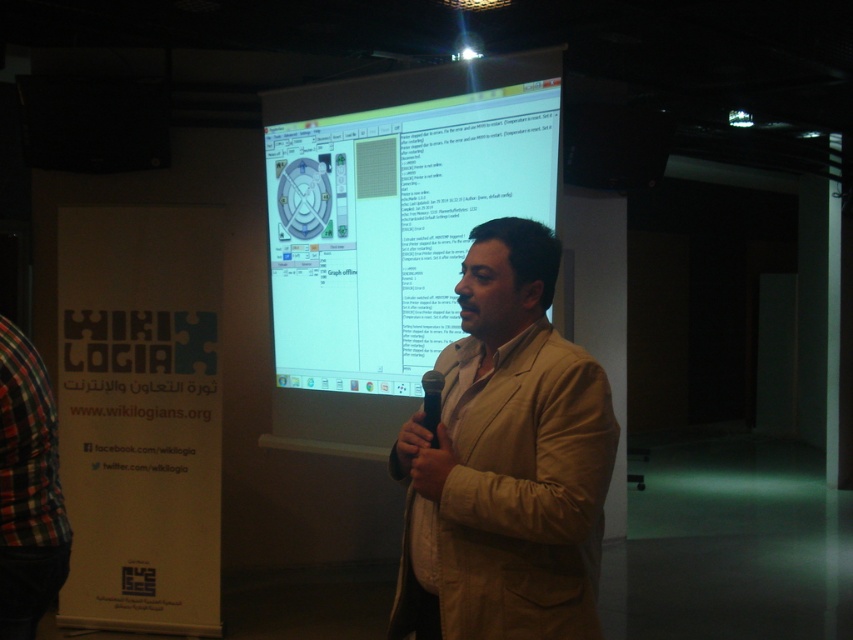
Question: Can you confirm if plaid fabric shirt at left is thinner than black plastic microphone at center?

Choices:
 (A) no
 (B) yes

Answer: (A)

Question: Estimate the real-world distances between objects in this image. Which object is closer to the black plastic microphone at center?

Choices:
 (A) beige fabric coat at center
 (B) white glossy projection screen at center
 (C) plaid fabric shirt at left

Answer: (A)

Question: Which point is farther from the camera taking this photo?

Choices:
 (A) (438, 442)
 (B) (311, 401)
 (C) (572, 362)
 (D) (1, 504)

Answer: (B)

Question: Which point is closer to the camera?

Choices:
 (A) white glossy projection screen at center
 (B) plaid fabric shirt at left

Answer: (B)

Question: Does beige fabric coat at center have a smaller size compared to plaid fabric shirt at left?

Choices:
 (A) no
 (B) yes

Answer: (A)

Question: Does beige fabric coat at center have a smaller size compared to black plastic microphone at center?

Choices:
 (A) no
 (B) yes

Answer: (A)